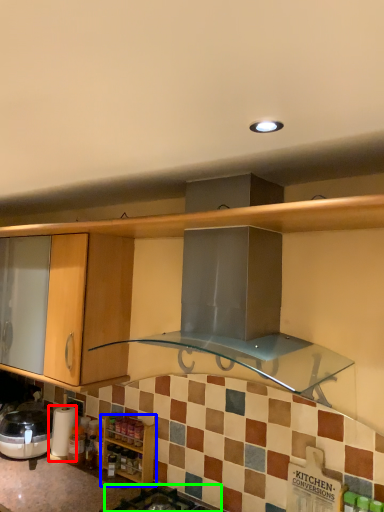
Question: Which object is positioned farthest from appliance (highlighted by a red box)? Select from cabinetry (highlighted by a blue box) and gas stove (highlighted by a green box).

Choices:
 (A) cabinetry
 (B) gas stove

Answer: (B)